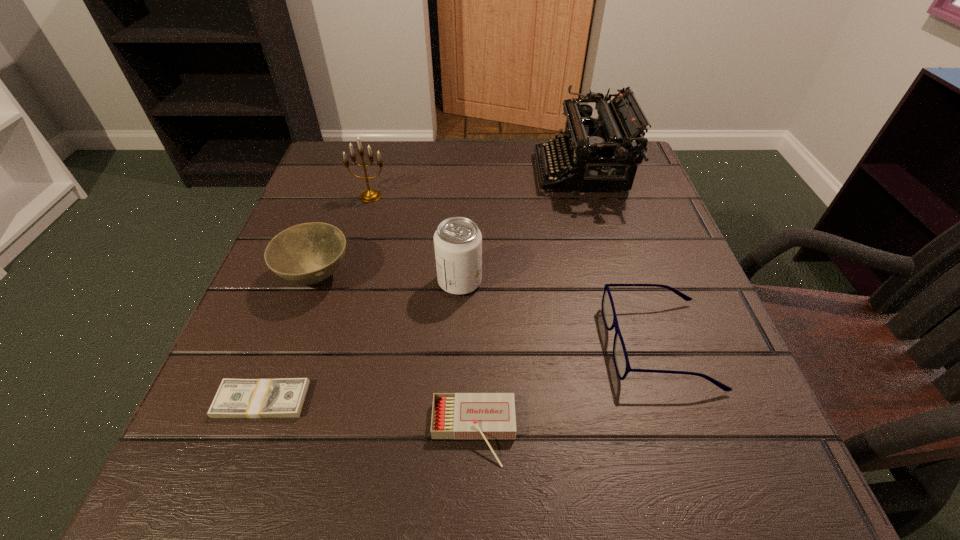
I want to click on empty location between the spectacles and the shortest object, so click(460, 372).

Where is `vacant space that's between the sixth tallest object and the shortest object`? The height and width of the screenshot is (540, 960). vacant space that's between the sixth tallest object and the shortest object is located at coordinates [x=368, y=416].

I want to click on object that is the nearest to the dollar, so click(308, 253).

Locate which object is the third closest to the second shortest object. Please provide its 2D coordinates. Your answer should be formatted as a tuple, i.e. [(x, y)], where the tuple contains the x and y coordinates of a point satisfying the conditions above.

[(457, 241)]

Where is `vacant space that satisfies the following two spatial constraints: 1. on the keyboard of the typewriter; 2. on the front side of the sixth shortest object`? This screenshot has width=960, height=540. vacant space that satisfies the following two spatial constraints: 1. on the keyboard of the typewriter; 2. on the front side of the sixth shortest object is located at coordinates point(588,196).

The width and height of the screenshot is (960, 540). Find the location of `free space in the image that satisfies the following two spatial constraints: 1. on the back side of the shortest object; 2. on the right side of the candelabrum`. free space in the image that satisfies the following two spatial constraints: 1. on the back side of the shortest object; 2. on the right side of the candelabrum is located at coordinates (339, 196).